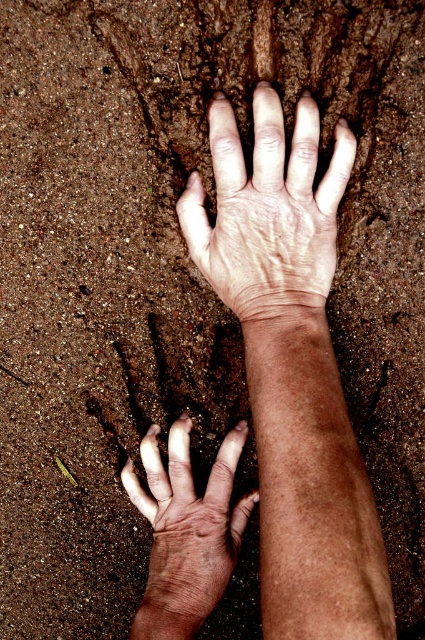
Question: Can you confirm if dry skin hand at upper center is positioned above dry skin hand at lower left?

Choices:
 (A) yes
 (B) no

Answer: (A)

Question: Is dry skin hand at upper center above dry skin hand at lower left?

Choices:
 (A) yes
 (B) no

Answer: (A)

Question: Is dry skin hand at upper center wider than dry skin hand at lower left?

Choices:
 (A) yes
 (B) no

Answer: (A)

Question: Which of the following is the closest to the observer?

Choices:
 (A) (181, 550)
 (B) (294, 241)

Answer: (B)

Question: Which object is closer to the camera taking this photo?

Choices:
 (A) dry skin hand at lower left
 (B) dry skin hand at upper center

Answer: (B)